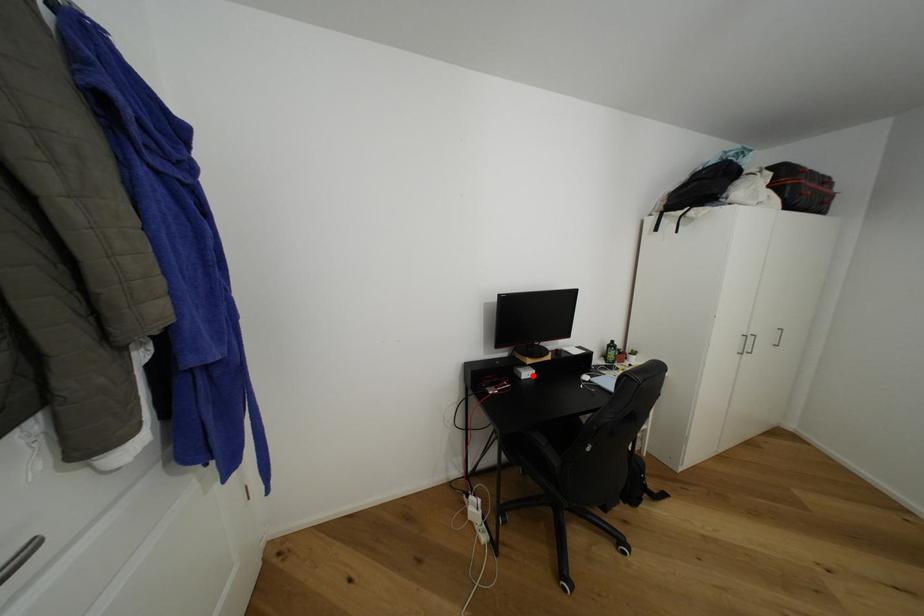
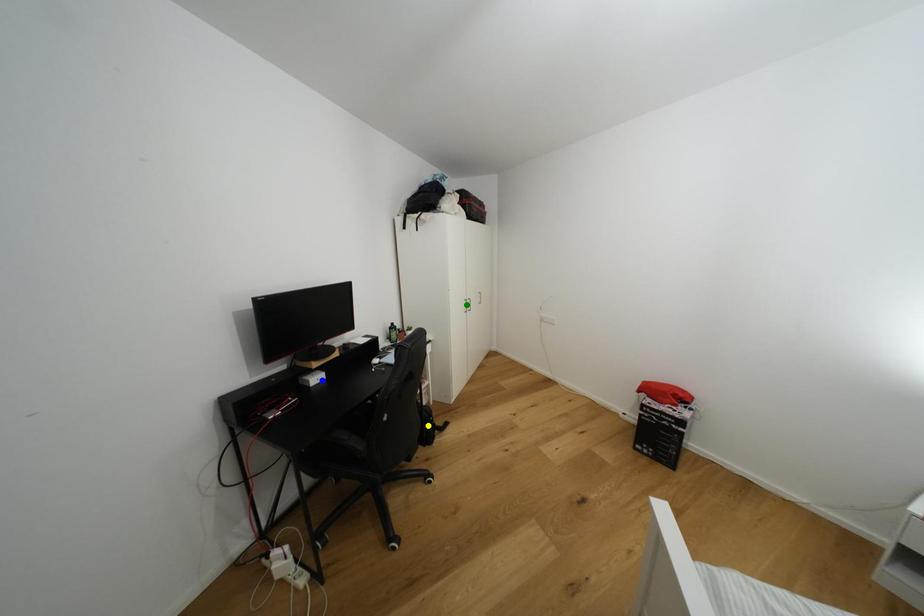
Question: I am providing you with two images of the same scene from different viewpoints. A red point is marked on the first image. You are given multiple points on the second image. Which mark in image 2 goes with the point in image 1?

Choices:
 (A) green point
 (B) blue point
 (C) yellow point

Answer: (B)